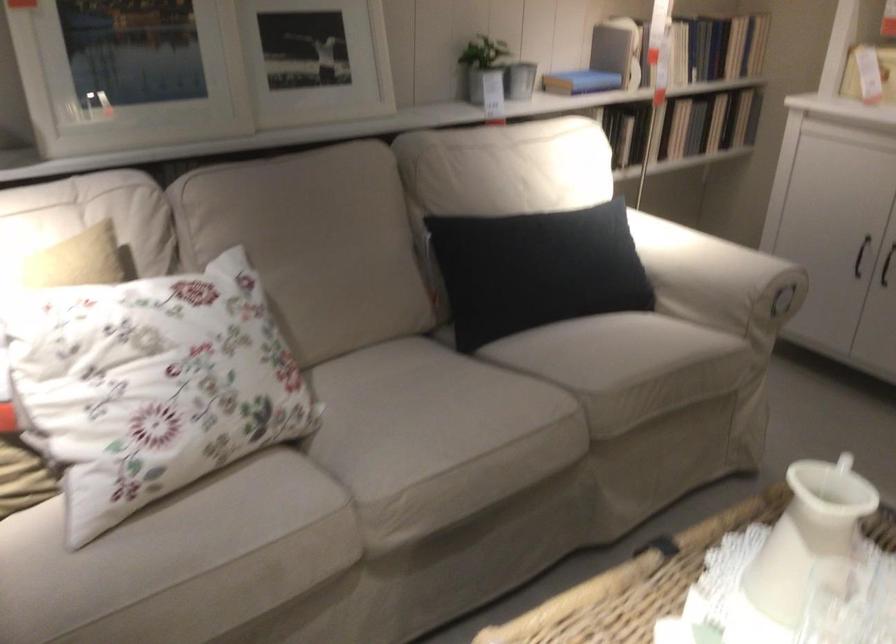
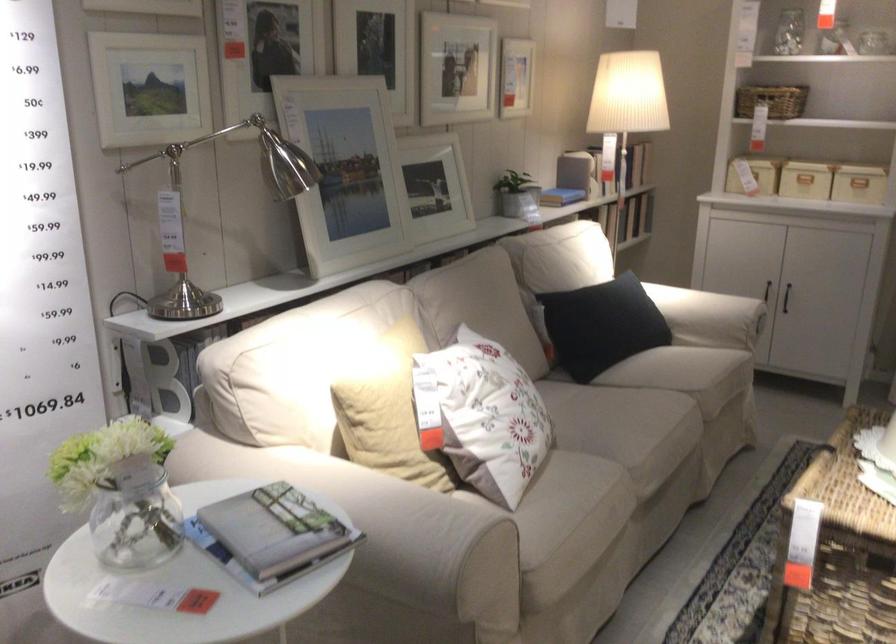
The point at (567, 91) is marked in the first image. Where is the corresponding point in the second image?

(561, 194)